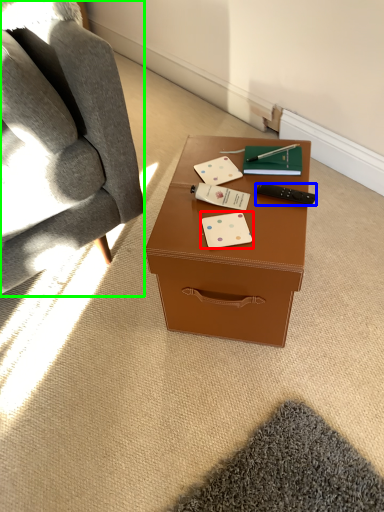
Question: Considering the real-world distances, which object is closest to business card (highlighted by a red box)? remote control (highlighted by a blue box) or chair (highlighted by a green box).

Choices:
 (A) remote control
 (B) chair

Answer: (A)